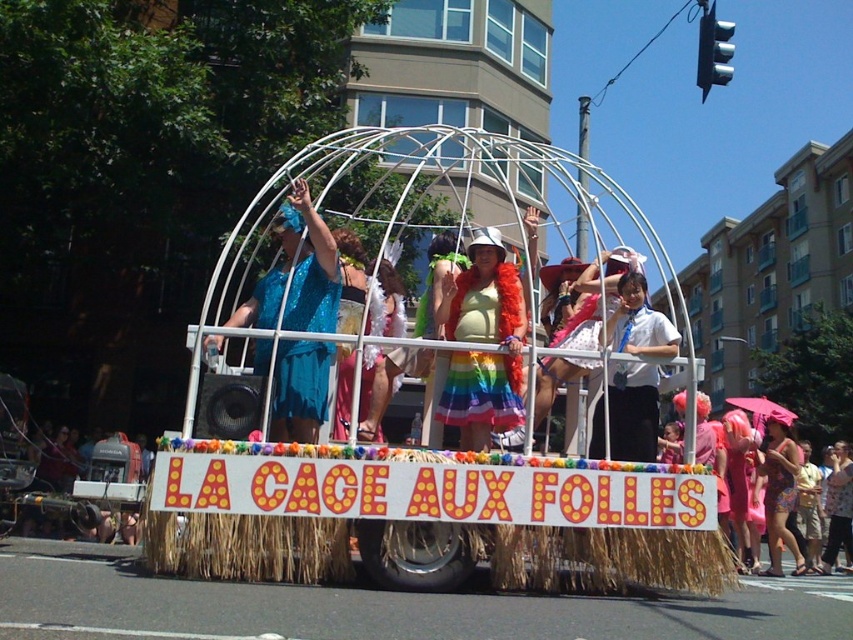
Question: Is blue sequined dress at center to the right of floral print dress at center from the viewer's perspective?

Choices:
 (A) yes
 (B) no

Answer: (B)

Question: Can you confirm if pink satin dress at lower right is positioned above floral print dress at center?

Choices:
 (A) no
 (B) yes

Answer: (A)

Question: Which point appears closest to the camera in this image?

Choices:
 (A) (508, 368)
 (B) (772, 486)
 (C) (296, 310)

Answer: (A)

Question: Which is nearer to the white shirt at center?

Choices:
 (A) floral print dress at center
 (B) blue sequined dress at center
 (C) rainbow fabric dress at center
 (D) pink satin dress at lower right

Answer: (C)

Question: Which of the following is the closest to the observer?

Choices:
 (A) floral print dress at center
 (B) blue sequined dress at center

Answer: (B)

Question: Can you confirm if blue sequined dress at center is thinner than pink satin dress at lower right?

Choices:
 (A) no
 (B) yes

Answer: (A)